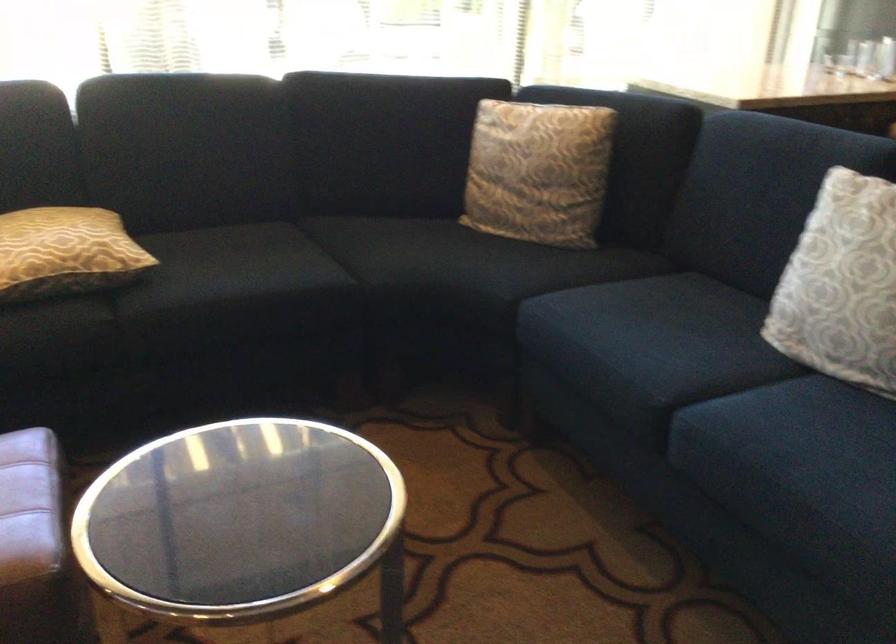
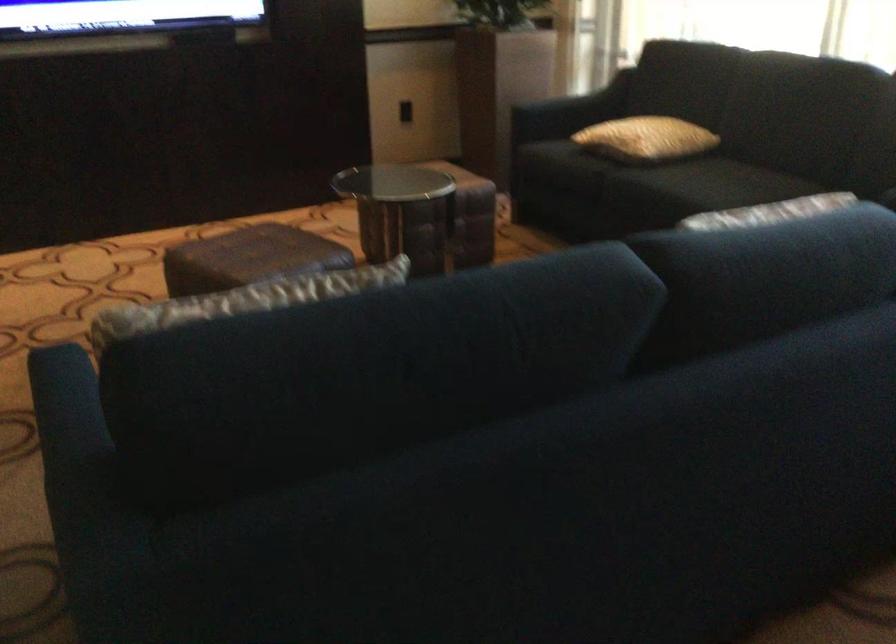
In the second image, find the point that corresponds to point (117, 247) in the first image.

(645, 138)